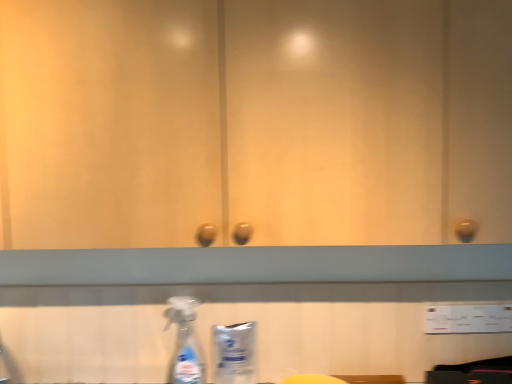
Question: From the image's perspective, is yellow matte sponge at lower center over white plastic bottle at lower center?

Choices:
 (A) yes
 (B) no

Answer: (B)

Question: From the image's perspective, is yellow matte sponge at lower center under white plastic bottle at lower center?

Choices:
 (A) no
 (B) yes

Answer: (B)

Question: Is yellow matte sponge at lower center not close to white plastic bottle at lower center?

Choices:
 (A) yes
 (B) no

Answer: (B)

Question: Can you confirm if yellow matte sponge at lower center is shorter than white plastic bottle at lower center?

Choices:
 (A) no
 (B) yes

Answer: (B)

Question: From a real-world perspective, is yellow matte sponge at lower center located higher than white plastic bottle at lower center?

Choices:
 (A) yes
 (B) no

Answer: (B)

Question: Is yellow matte sponge at lower center closer to the viewer compared to white plastic bottle at lower center?

Choices:
 (A) yes
 (B) no

Answer: (A)

Question: Is the depth of transparent plastic spray bottle at lower left greater than that of yellow matte sponge at lower center?

Choices:
 (A) yes
 (B) no

Answer: (A)

Question: Is transparent plastic spray bottle at lower left to the right of yellow matte sponge at lower center from the viewer's perspective?

Choices:
 (A) yes
 (B) no

Answer: (B)

Question: From a real-world perspective, is transparent plastic spray bottle at lower left on yellow matte sponge at lower center?

Choices:
 (A) no
 (B) yes

Answer: (B)

Question: Does transparent plastic spray bottle at lower left have a greater width compared to yellow matte sponge at lower center?

Choices:
 (A) no
 (B) yes

Answer: (A)

Question: Can you confirm if transparent plastic spray bottle at lower left is smaller than yellow matte sponge at lower center?

Choices:
 (A) no
 (B) yes

Answer: (B)

Question: Would you consider transparent plastic spray bottle at lower left to be distant from yellow matte sponge at lower center?

Choices:
 (A) yes
 (B) no

Answer: (B)

Question: Is yellow matte sponge at lower center positioned beyond the bounds of transparent plastic spray bottle at lower left?

Choices:
 (A) no
 (B) yes

Answer: (B)